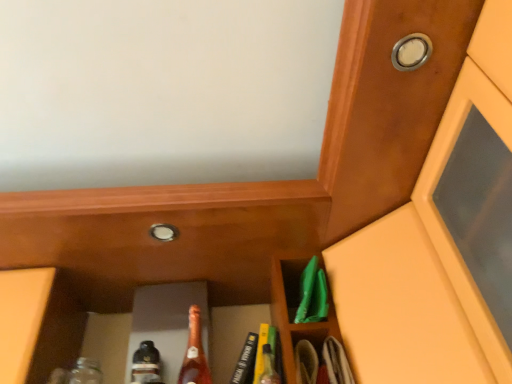
Question: Should I look upward or downward to see matte brown cabinet at center?

Choices:
 (A) up
 (B) down

Answer: (B)

Question: Is translucent glass bottle at center smaller than silver metallic knob at center, which is counted as the 1th knob, starting from the left?

Choices:
 (A) yes
 (B) no

Answer: (B)

Question: Can you confirm if translucent glass bottle at center is bigger than silver metallic knob at center, which is counted as the 1th knob, starting from the left?

Choices:
 (A) no
 (B) yes

Answer: (B)

Question: Is translucent glass bottle at center located outside silver metallic knob at center, which is the 2th knob in right-to-left order?

Choices:
 (A) no
 (B) yes

Answer: (B)

Question: Can silver metallic knob at center, which is counted as the 1th knob, starting from the left, be found inside translucent glass bottle at center?

Choices:
 (A) yes
 (B) no

Answer: (B)

Question: Would you consider translucent glass bottle at center to be distant from silver metallic knob at center, the 1th knob ordered from the bottom?

Choices:
 (A) no
 (B) yes

Answer: (A)

Question: Can you confirm if translucent glass bottle at center is taller than silver metallic knob at center, acting as the first knob starting from the back?

Choices:
 (A) yes
 (B) no

Answer: (A)

Question: Considering the relative sizes of wooden door at upper right and silver metallic knob at center, which is counted as the 1th knob, starting from the left, in the image provided, is wooden door at upper right thinner than silver metallic knob at center, which is counted as the 1th knob, starting from the left,?

Choices:
 (A) yes
 (B) no

Answer: (B)

Question: Considering the relative sizes of wooden door at upper right and silver metallic knob at center, the 1th knob ordered from the bottom, in the image provided, is wooden door at upper right taller than silver metallic knob at center, the 1th knob ordered from the bottom,?

Choices:
 (A) yes
 (B) no

Answer: (A)

Question: From the image's perspective, is wooden door at upper right on silver metallic knob at center, which is counted as the 1th knob, starting from the left?

Choices:
 (A) yes
 (B) no

Answer: (A)

Question: Can you confirm if wooden door at upper right is bigger than silver metallic knob at center, acting as the first knob starting from the back?

Choices:
 (A) no
 (B) yes

Answer: (B)

Question: Is wooden door at upper right not near silver metallic knob at center, which is counted as the second knob, starting from the top?

Choices:
 (A) yes
 (B) no

Answer: (B)

Question: From a real-world perspective, is wooden door at upper right on silver metallic knob at center, the 1th knob ordered from the bottom?

Choices:
 (A) yes
 (B) no

Answer: (B)

Question: Is metallic silver knob at upper right, marked as the second knob in a bottom-to-top arrangement, to the right of matte glass bottle at center from the viewer's perspective?

Choices:
 (A) yes
 (B) no

Answer: (A)